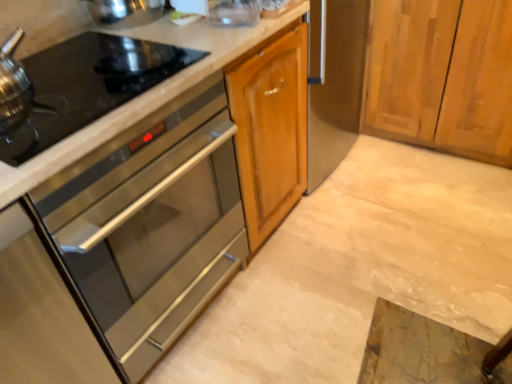
Question: Considering the positions of point (510, 263) and point (91, 39), is point (510, 263) closer or farther from the camera than point (91, 39)?

Choices:
 (A) closer
 (B) farther

Answer: (B)

Question: Considering the positions of marble countertop at center and black glass gas stove at left in the image, is marble countertop at center bigger or smaller than black glass gas stove at left?

Choices:
 (A) big
 (B) small

Answer: (A)

Question: Which object is the closest to the marble countertop at center?

Choices:
 (A) black glass gas stove at left
 (B) stainless steel oven at left

Answer: (B)

Question: Estimate the real-world distances between objects in this image. Which object is farther from the marble countertop at center?

Choices:
 (A) black glass gas stove at left
 (B) stainless steel oven at left

Answer: (A)